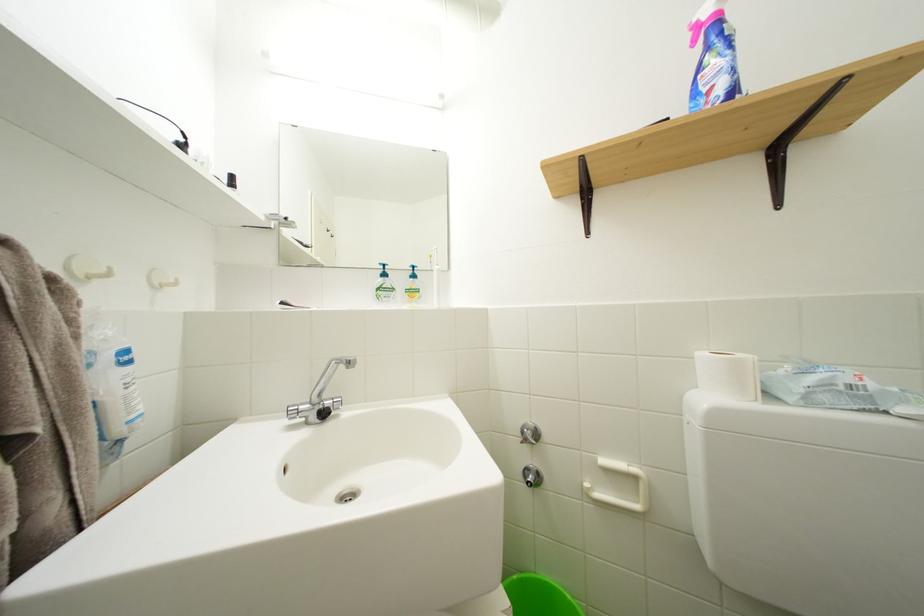
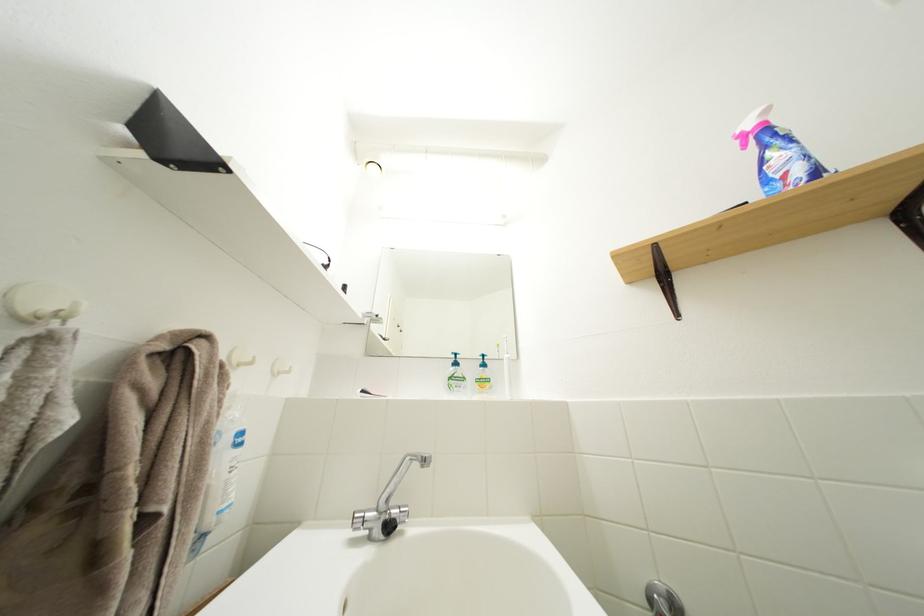
The point at (x=76, y=274) is marked in the first image. Where is the corresponding point in the second image?

(238, 363)